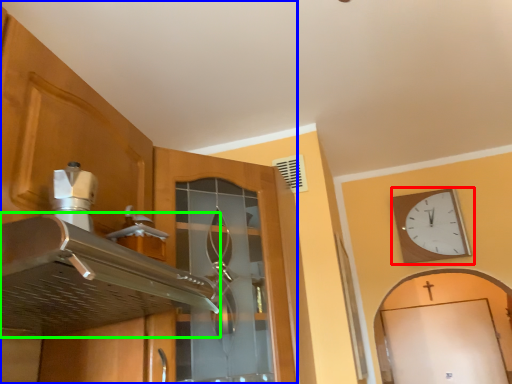
Question: Which is nearer to the wall clock (highlighted by a red box)? cabinetry (highlighted by a blue box) or exhaust hood (highlighted by a green box).

Choices:
 (A) cabinetry
 (B) exhaust hood

Answer: (A)